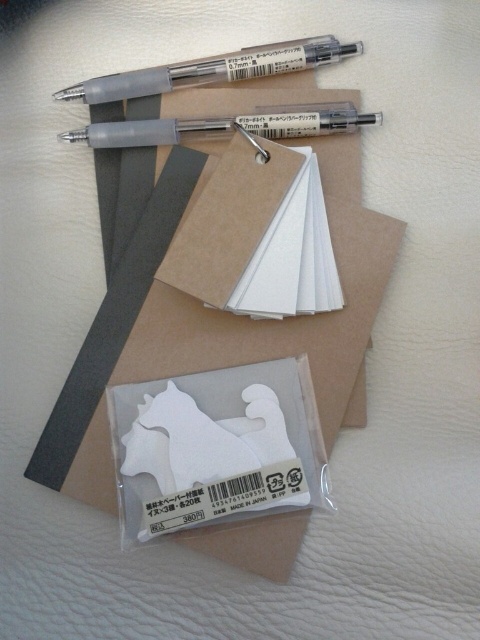
You have a small box that can only fit one pen at a time. If you want to place either the transparent plastic pen at upper center or the matte gray pen at upper center into the box, which pen would you choose to ensure it fits?

The transparent plastic pen at upper center has a smaller width than the matte gray pen at upper center, so you should choose the transparent plastic pen at upper center to ensure it fits in the box.

You are organizing stationery items on a desk. You have a transparent plastic pen at upper center and a matte gray pen at upper center. Which pen is positioned to the left side of the other?

The transparent plastic pen at upper center is to the left of the matte gray pen at upper center.